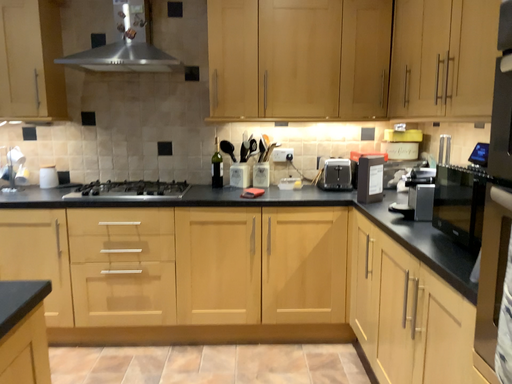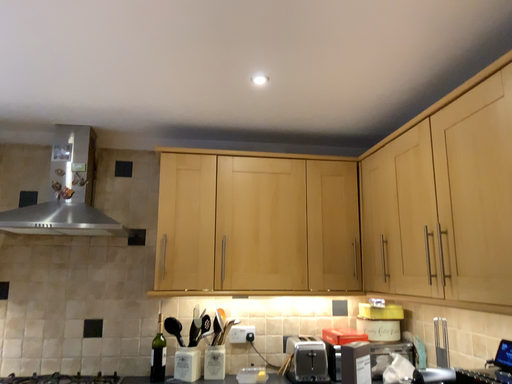
Question: How did the camera likely rotate when shooting the video?

Choices:
 (A) rotated upward
 (B) rotated downward

Answer: (A)